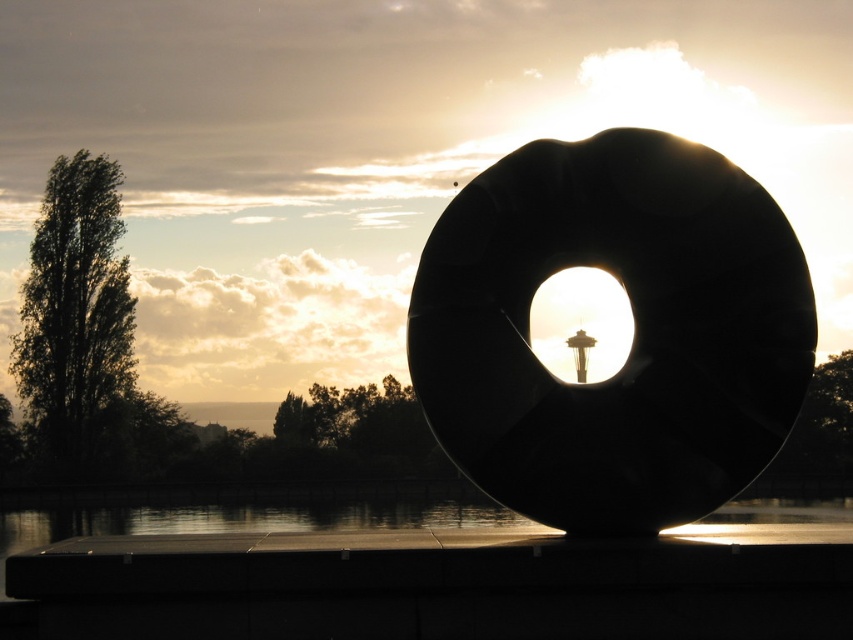
Question: Which of the following is the farthest from the observer?

Choices:
 (A) (184, 520)
 (B) (674, 198)

Answer: (A)

Question: Is black matte ring at center further to camera compared to transparent glass water at bottom?

Choices:
 (A) no
 (B) yes

Answer: (B)

Question: Can you confirm if black matte ring at center is smaller than transparent glass water at bottom?

Choices:
 (A) no
 (B) yes

Answer: (B)

Question: Can you confirm if black matte ring at center is thinner than transparent glass water at bottom?

Choices:
 (A) no
 (B) yes

Answer: (B)